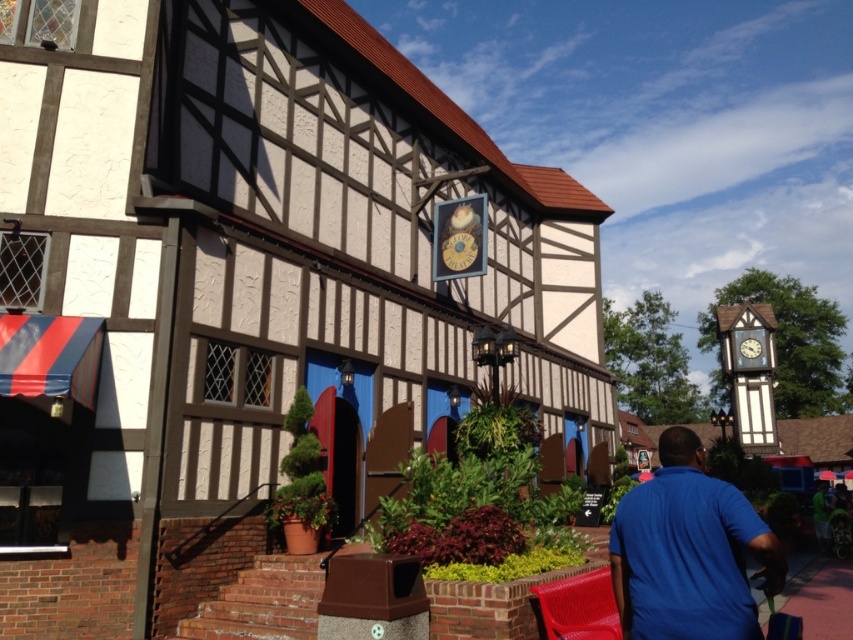
You are standing in front of the Tudor building and notice a blue matte shirt at center and a wooden clock at center. Which object is nearer to you?

The blue matte shirt at center is closer to the viewer than the wooden clock at center.

You are a visitor standing in front of the Tudor building and notice two items at the center entrance area. Which item is positioned lower between the blue matte shirt at center and the wooden clock at center?

The blue matte shirt at center is positioned below the wooden clock at center, so it is lower.